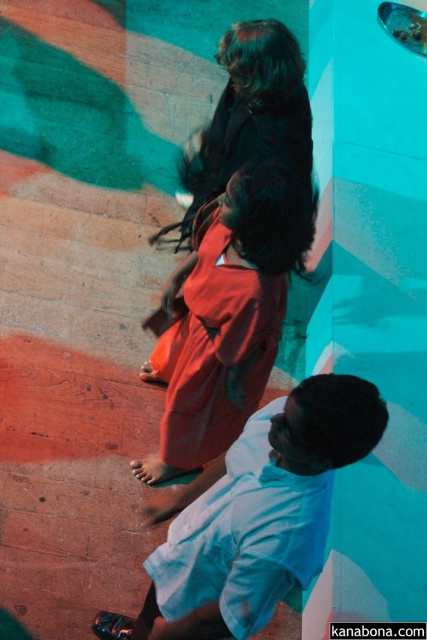
Question: Which point is farther to the camera?

Choices:
 (A) (254, 340)
 (B) (319, 404)

Answer: (A)

Question: Which object appears closest to the camera in this image?

Choices:
 (A) matte red dress at center
 (B) white cotton shirt at lower center

Answer: (B)

Question: Does white cotton shirt at lower center have a lesser width compared to matte red dress at center?

Choices:
 (A) yes
 (B) no

Answer: (B)

Question: Is white cotton shirt at lower center bigger than matte red dress at center?

Choices:
 (A) yes
 (B) no

Answer: (A)

Question: Is white cotton shirt at lower center closer to camera compared to matte red dress at center?

Choices:
 (A) yes
 (B) no

Answer: (A)

Question: Which of the following is the farthest from the observer?

Choices:
 (A) (210, 392)
 (B) (237, 618)

Answer: (A)